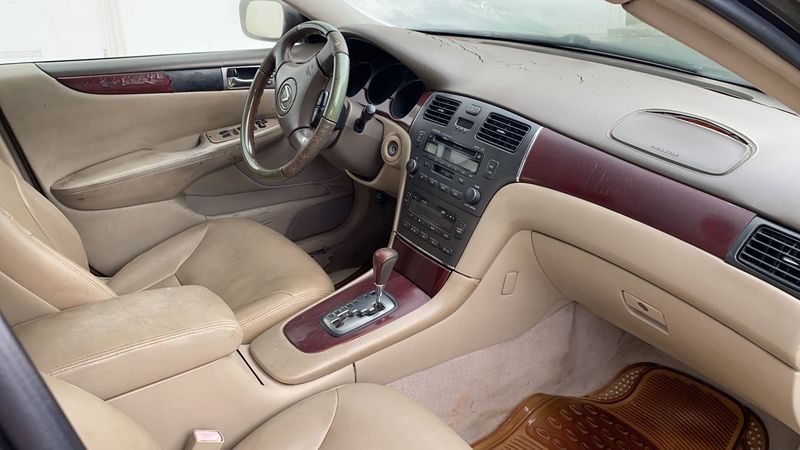
Find the location of a particular element. stereo is located at coordinates (466, 158).